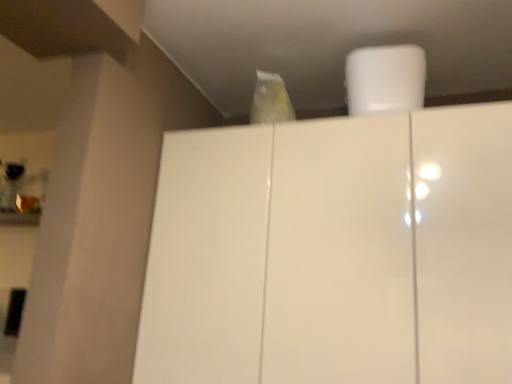
Measure the distance between point (397, 76) and camera.

They are 38.31 inches apart.

Locate an element on the screen. This screenshot has height=384, width=512. white matte paper towel at upper center is located at coordinates (385, 79).

Describe the element at coordinates (385, 79) in the screenshot. This screenshot has width=512, height=384. I see `white matte paper towel at upper center` at that location.

Measure the distance between glossy white cupboard at center and camera.

28.91 inches.

Find the location of a particular element. glossy white cupboard at center is located at coordinates (333, 252).

Describe the element at coordinates (333, 252) in the screenshot. I see `glossy white cupboard at center` at that location.

Image resolution: width=512 pixels, height=384 pixels. In order to click on white matte paper towel at upper center in this screenshot , I will do `click(385, 79)`.

Is white matte paper towel at upper center to the left of glossy white cupboard at center from the viewer's perspective?

In fact, white matte paper towel at upper center is to the right of glossy white cupboard at center.

Which object is more forward, white matte paper towel at upper center or glossy white cupboard at center?

Positioned in front is glossy white cupboard at center.

Which is in front, point (348, 70) or point (466, 260)?

The point (466, 260) is closer.

From the image's perspective, relative to glossy white cupboard at center, is white matte paper towel at upper center above or below?

Based on their image positions, white matte paper towel at upper center is located above glossy white cupboard at center.

From a real-world perspective, does white matte paper towel at upper center sit lower than glossy white cupboard at center?

Actually, white matte paper towel at upper center is physically above glossy white cupboard at center in the real world.

Between white matte paper towel at upper center and glossy white cupboard at center, which one has larger width?

glossy white cupboard at center.

Considering the relative sizes of white matte paper towel at upper center and glossy white cupboard at center in the image provided, is white matte paper towel at upper center shorter than glossy white cupboard at center?

Yes, white matte paper towel at upper center is shorter than glossy white cupboard at center.

Between white matte paper towel at upper center and glossy white cupboard at center, which one has smaller size?

white matte paper towel at upper center is smaller.

Is white matte paper towel at upper center situated inside glossy white cupboard at center or outside?

white matte paper towel at upper center cannot be found inside glossy white cupboard at center.

Is white matte paper towel at upper center not near glossy white cupboard at center?

They are positioned close to each other.

Is white matte paper towel at upper center aimed at glossy white cupboard at center?

No, white matte paper towel at upper center is not aimed at glossy white cupboard at center.

How different are the orientations of white matte paper towel at upper center and glossy white cupboard at center in degrees?

white matte paper towel at upper center and glossy white cupboard at center are facing 6.99 degrees away from each other.

The height and width of the screenshot is (384, 512). What are the coordinates of `paper towel that is behind the glossy white cupboard at center` in the screenshot? It's located at (385, 79).

Visually, is glossy white cupboard at center positioned to the left or to the right of white matte paper towel at upper center?

Based on their positions, glossy white cupboard at center is located to the left of white matte paper towel at upper center.

Between glossy white cupboard at center and white matte paper towel at upper center, which one is positioned in front?

glossy white cupboard at center is in front.

Is point (453, 144) positioned after point (356, 77)?

No.

From the image's perspective, is glossy white cupboard at center on top of white matte paper towel at upper center?

No, from the image's perspective, glossy white cupboard at center is not over white matte paper towel at upper center.

From a real-world perspective, which object stands above the other?

white matte paper towel at upper center is physically above.

Can you confirm if glossy white cupboard at center is thinner than white matte paper towel at upper center?

In fact, glossy white cupboard at center might be wider than white matte paper towel at upper center.

Which of these two, glossy white cupboard at center or white matte paper towel at upper center, stands shorter?

With less height is white matte paper towel at upper center.

Is glossy white cupboard at center bigger than white matte paper towel at upper center?

Correct, glossy white cupboard at center is larger in size than white matte paper towel at upper center.

Is glossy white cupboard at center not inside white matte paper towel at upper center?

glossy white cupboard at center is positioned outside white matte paper towel at upper center.

Is the surface of glossy white cupboard at center in direct contact with white matte paper towel at upper center?

glossy white cupboard at center is not next to white matte paper towel at upper center, and they're not touching.

Is glossy white cupboard at center looking in the opposite direction of white matte paper towel at upper center?

No.

What's the angular difference between glossy white cupboard at center and white matte paper towel at upper center's facing directions?

glossy white cupboard at center and white matte paper towel at upper center are facing 6.99 degrees away from each other.

Where is `paper towel above the glossy white cupboard at center (from a real-world perspective)`? paper towel above the glossy white cupboard at center (from a real-world perspective) is located at coordinates (385, 79).

Where is `cupboard that is below the white matte paper towel at upper center (from the image's perspective)`? The width and height of the screenshot is (512, 384). cupboard that is below the white matte paper towel at upper center (from the image's perspective) is located at coordinates (333, 252).

Where is `paper towel on the right of the glossy white cupboard at center`? This screenshot has width=512, height=384. paper towel on the right of the glossy white cupboard at center is located at coordinates (385, 79).